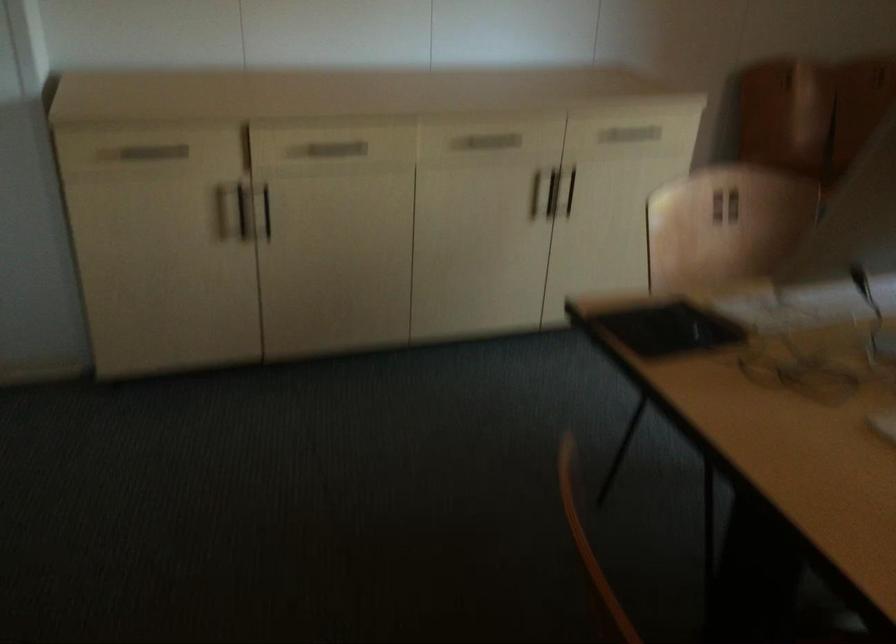
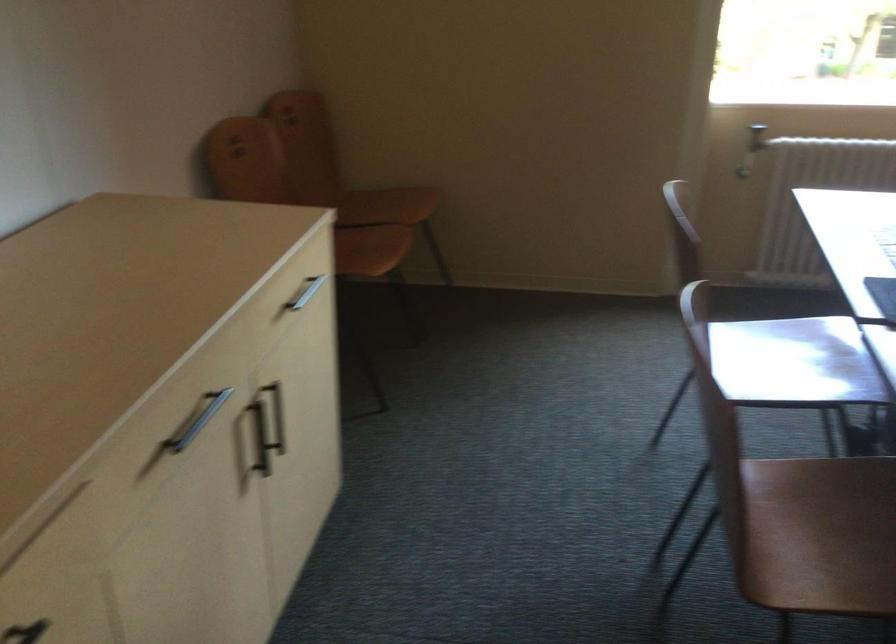
Where in the second image is the point corresponding to (586,200) from the first image?

(277, 415)